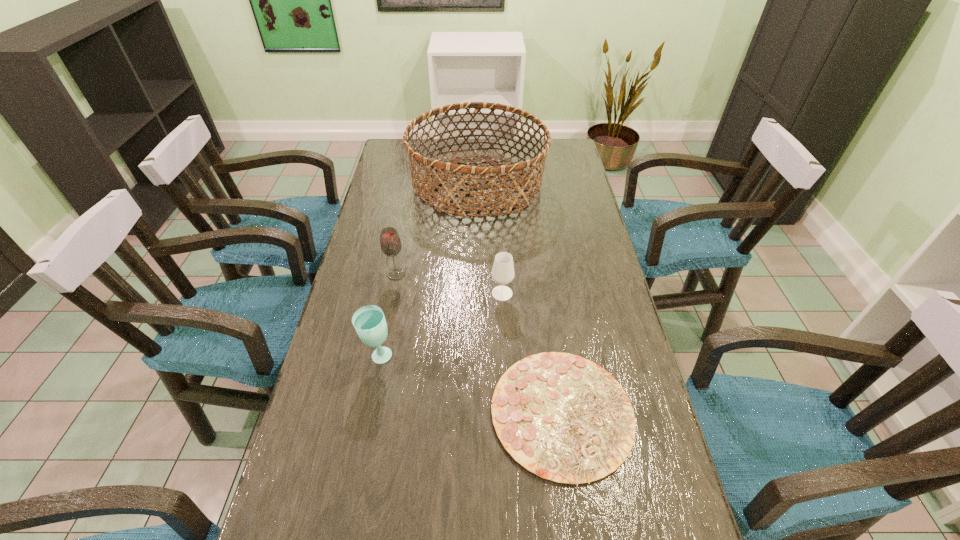
This screenshot has width=960, height=540. What are the coordinates of `vacant point located 0.330m on the back of the shortest object` in the screenshot? It's located at (542, 265).

This screenshot has height=540, width=960. In order to click on object present at the far edge in this screenshot , I will do `click(444, 168)`.

Locate an element on the screen. basket present at the left edge is located at coordinates (444, 168).

Where is `basket located in the right edge section of the desktop`? The image size is (960, 540). basket located in the right edge section of the desktop is located at coordinates click(x=444, y=168).

At what (x,y) coordinates should I click in order to perform the action: click on pizza present at the right edge. Please return your answer as a coordinate pair (x, y). Image resolution: width=960 pixels, height=540 pixels. Looking at the image, I should click on (564, 418).

Image resolution: width=960 pixels, height=540 pixels. Find the location of `object that is at the far left corner`. object that is at the far left corner is located at coordinates [x=444, y=168].

Locate an element on the screen. object present at the far right corner is located at coordinates (444, 168).

This screenshot has height=540, width=960. I want to click on free location at the left edge, so click(x=376, y=423).

This screenshot has width=960, height=540. In the image, there is a desktop. What are the coordinates of `vacant area at the right edge` in the screenshot? It's located at pos(576,194).

The height and width of the screenshot is (540, 960). Identify the location of free location at the far left corner of the desktop. (396, 156).